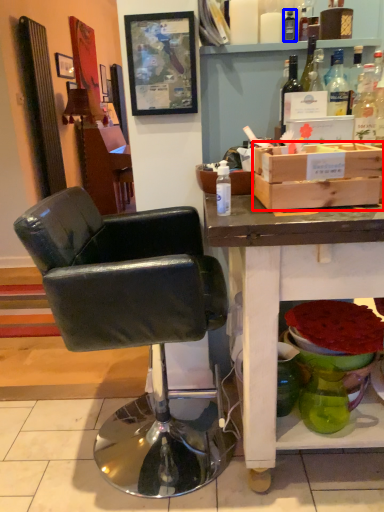
Question: Among these objects, which one is farthest to the camera, box (highlighted by a red box) or bottle (highlighted by a blue box)?

Choices:
 (A) box
 (B) bottle

Answer: (B)